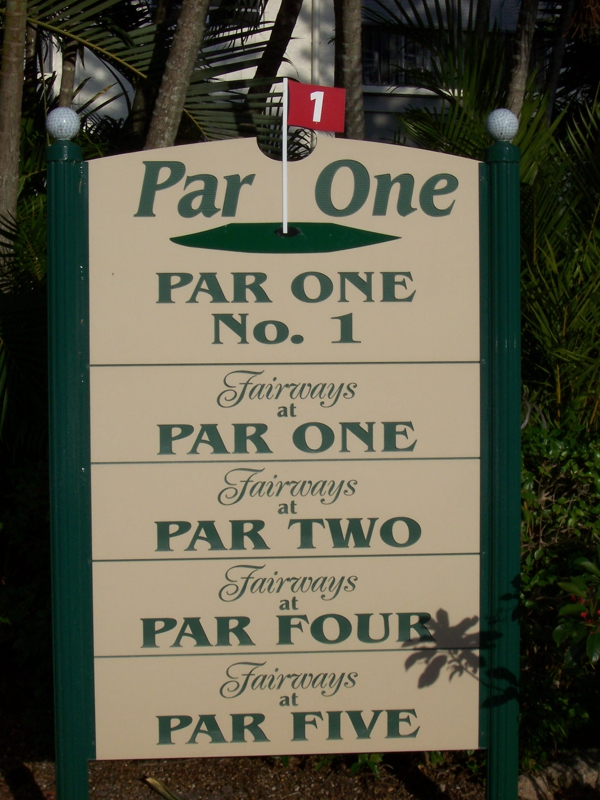
I want to click on wall in background, so click(297, 54), click(56, 62), click(116, 110).